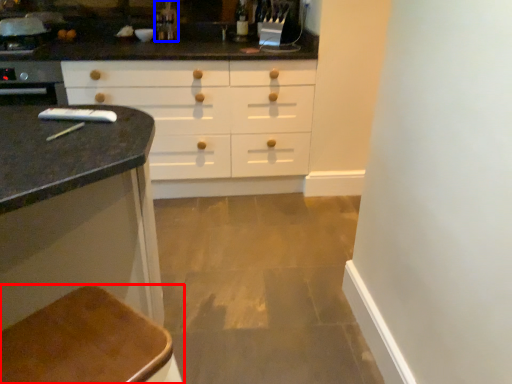
Question: Which object appears farthest to the camera in this image, furniture (highlighted by a red box) or faucet (highlighted by a blue box)?

Choices:
 (A) furniture
 (B) faucet

Answer: (B)